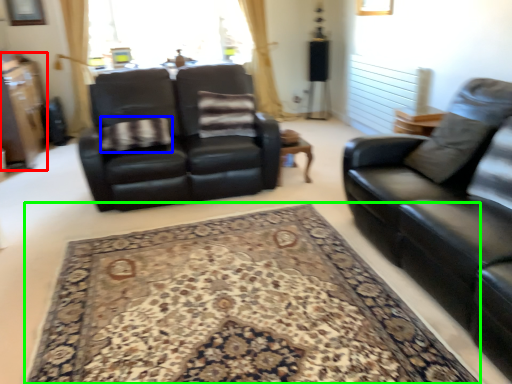
Question: Estimate the real-world distances between objects in this image. Which object is closer to dresser (highlighted by a red box), blanket (highlighted by a blue box) or mat (highlighted by a green box)?

Choices:
 (A) blanket
 (B) mat

Answer: (A)